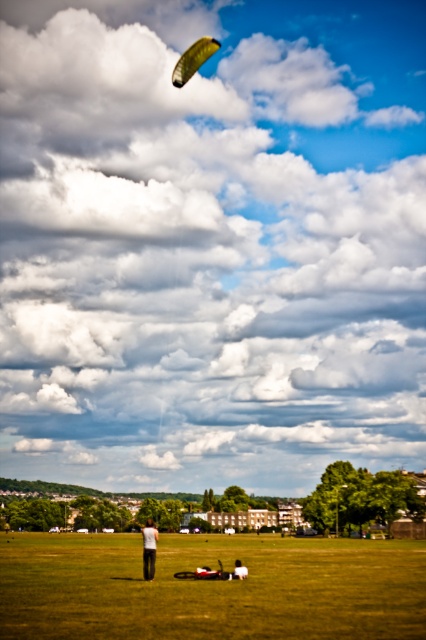
Is green grass at center shorter than white cotton shirt at center?

Indeed, green grass at center has a lesser height compared to white cotton shirt at center.

Looking at this image, is green grass at center taller than white cotton shirt at center?

No.

Looking at this image, who is more forward, (175, 611) or (149, 564)?

Point (175, 611)

Where is `green grass at center`? This screenshot has width=426, height=640. green grass at center is located at coordinates (210, 588).

Looking at this image, is the position of green grass at center more distant than that of dark gray pants at center?

No, it is not.

Is point (282, 570) farther from viewer compared to point (239, 564)?

Yes, it is behind point (239, 564).

Locate an element on the screen. green grass at center is located at coordinates (210, 588).

I want to click on green grass at center, so [210, 588].

Is point (201, 45) behind point (236, 566)?

Yes, it is.

Which of these two, green fabric parachute at upper center or dark gray pants at center, stands shorter?

dark gray pants at center

Between point (195, 64) and point (245, 566), which one is positioned in front?

Point (245, 566) is in front.

Identify the location of green fabric parachute at upper center. This screenshot has width=426, height=640. (192, 60).